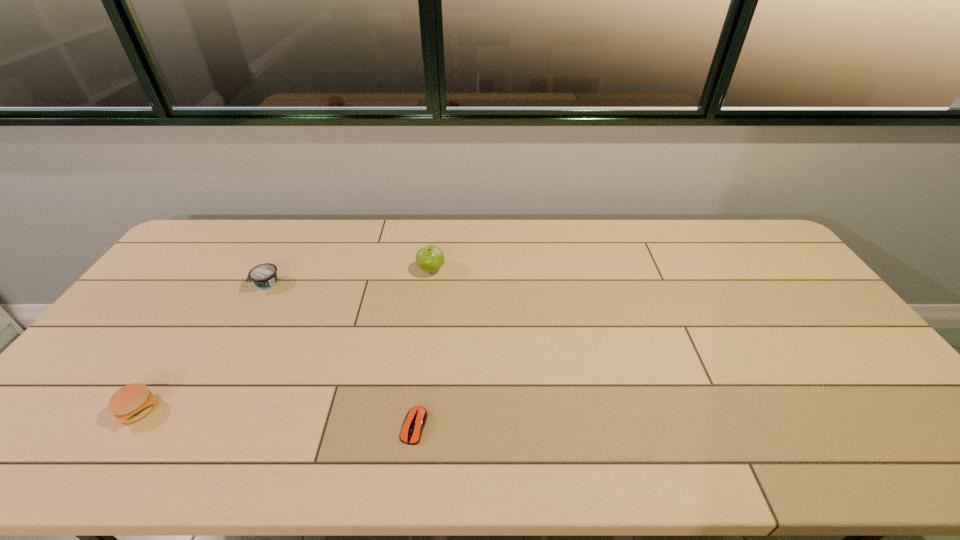
This screenshot has width=960, height=540. I want to click on free space between the tallest object and the shortest object, so click(422, 348).

Where is `free space between the computer mouse and the leftmost object`? This screenshot has height=540, width=960. free space between the computer mouse and the leftmost object is located at coordinates (276, 418).

At what (x,y) coordinates should I click in order to perform the action: click on free space between the computer mouse and the tallest object. Please return your answer as a coordinate pair (x, y). Looking at the image, I should click on (422, 348).

This screenshot has height=540, width=960. Find the location of `blank region between the apple and the yogurt`. blank region between the apple and the yogurt is located at coordinates pyautogui.click(x=349, y=277).

Where is `empty space that is in between the apple and the leftmost object`? This screenshot has height=540, width=960. empty space that is in between the apple and the leftmost object is located at coordinates (285, 340).

Find the location of `free space between the tallest object and the shortest object`. free space between the tallest object and the shortest object is located at coordinates (422, 348).

The image size is (960, 540). Find the location of `unoccupied area between the yogurt and the apple`. unoccupied area between the yogurt and the apple is located at coordinates click(x=349, y=277).

Choose which object is the nearest neighbor to the apple. Please provide its 2D coordinates. Your answer should be formatted as a tuple, i.e. [(x, y)], where the tuple contains the x and y coordinates of a point satisfying the conditions above.

[(264, 276)]

Locate which object is the third closest to the computer mouse. Please provide its 2D coordinates. Your answer should be formatted as a tuple, i.e. [(x, y)], where the tuple contains the x and y coordinates of a point satisfying the conditions above.

[(264, 276)]